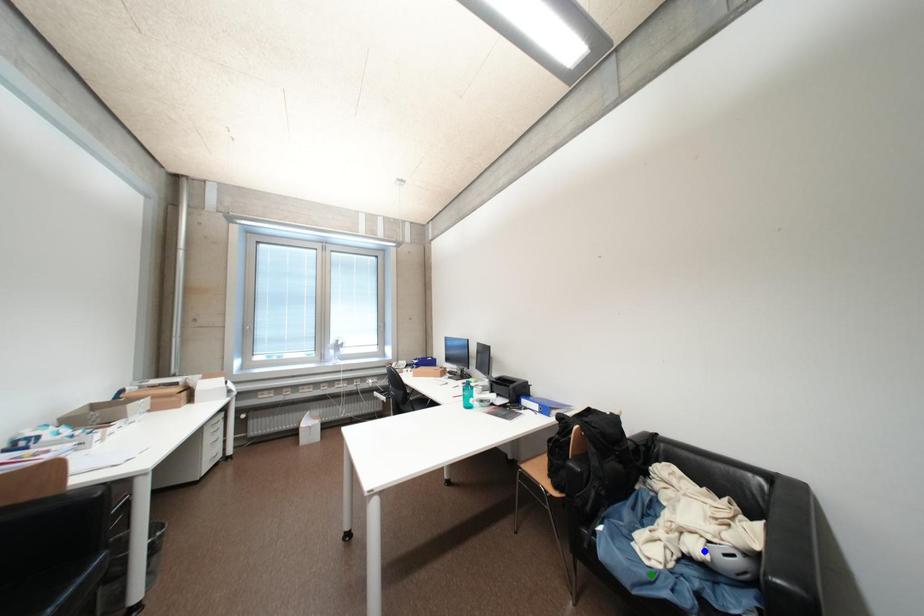
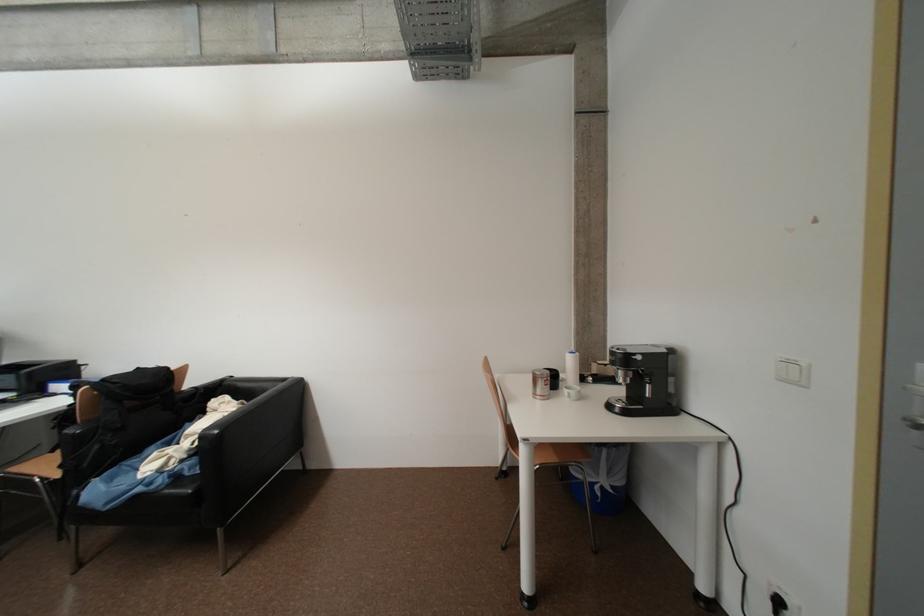
I am providing you with two images of the same scene from different viewpoints. Three points are marked in image1. Which point corresponds to a part or object that is occluded in image2?In image1, three points are marked. Which of them correspond to a part or object that is occluded in image2?Among the three points shown in image1, which one corresponds to a part or object that is no longer visible due to occlusion in image2?

Invisible in image2: yellow point, blue point.